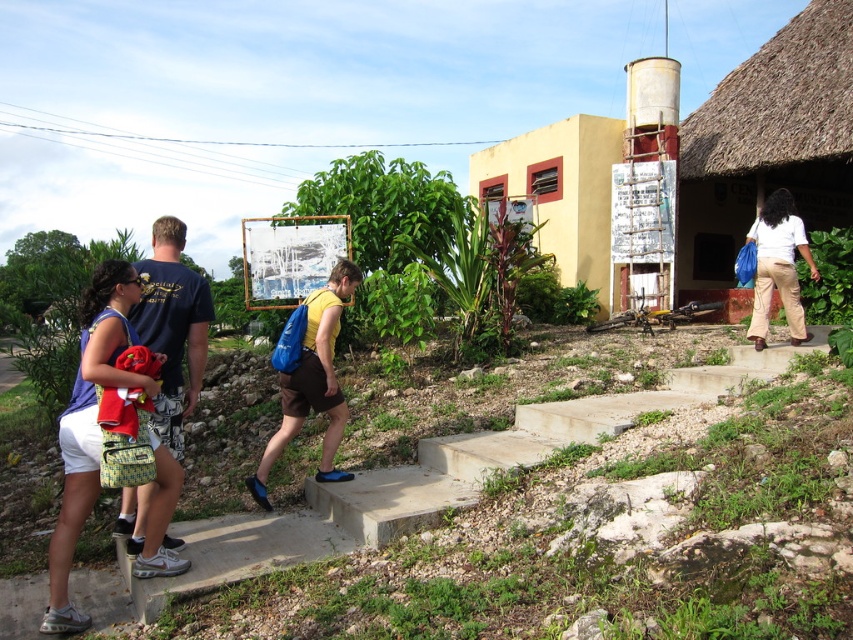
Question: Is matte blue t-shirt at left below white cotton shirt at right?

Choices:
 (A) yes
 (B) no

Answer: (A)

Question: Is concrete stairs at center below yellow matte building at upper center?

Choices:
 (A) no
 (B) yes

Answer: (B)

Question: Which object is farther from the camera taking this photo?

Choices:
 (A) matte blue t-shirt at left
 (B) concrete stairs at center
 (C) white cotton shirt at right
 (D) matte blue tank top at left

Answer: (C)

Question: Does yellow matte building at upper center lie in front of white cotton shirt at right?

Choices:
 (A) yes
 (B) no

Answer: (B)

Question: Which point appears farthest from the camera in this image?

Choices:
 (A) (785, 195)
 (B) (328, 454)
 (C) (604, 276)

Answer: (C)

Question: Which of the following is the closest to the observer?

Choices:
 (A) (180, 557)
 (B) (335, 401)
 (C) (566, 120)
 (D) (267, 620)

Answer: (D)